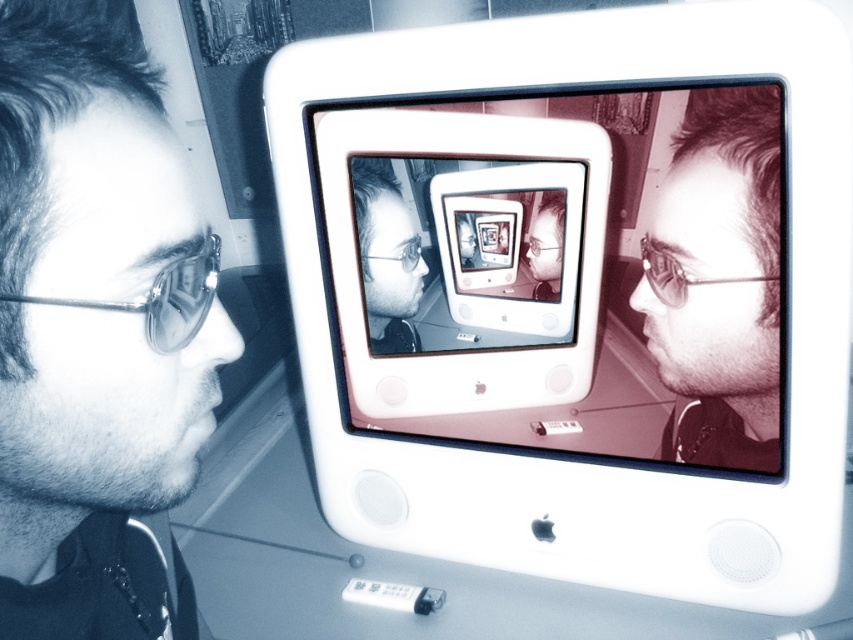
You are setting up a small display on a narrow shelf. You have a smooth metal face at left and a silver metallic ipod at center. Which object should you choose if you want to place the wider one on the shelf?

The smooth metal face at left is wider than the silver metallic ipod at center, so you should choose the smooth metal face at left if you want to place the wider one on the shelf.

You are trying to place a sticker exactly at the center of the matte black face at center. According to the coordinates provided, where should you place the sticker?

The sticker should be placed at the coordinates point (387, 257) on the matte black face at center.

You are setting up a display for a tech exhibition and want to ensure proper visibility of both the matte black face at center and the silver metallic ipod at center. Based on their positions, which object is placed higher in the image?

The matte black face at center is positioned over the silver metallic ipod at center, so it is placed higher in the image.